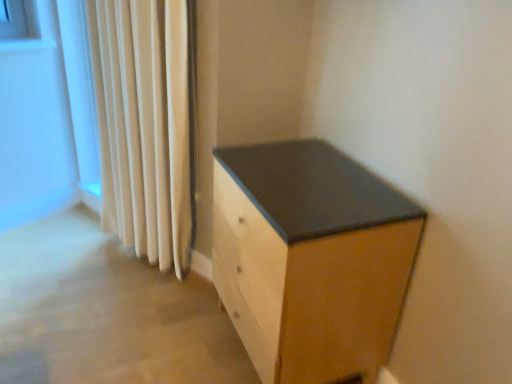
Question: Relative to beige fabric curtain at left, is matte black drawer at center in front or behind?

Choices:
 (A) behind
 (B) front

Answer: (B)

Question: From the image's perspective, is matte black drawer at center located above or below beige fabric curtain at left?

Choices:
 (A) above
 (B) below

Answer: (B)

Question: Based on their positions, is matte black drawer at center located to the left or right of beige fabric curtain at left?

Choices:
 (A) right
 (B) left

Answer: (A)

Question: From a real-world perspective, relative to matte black drawer at center, is beige fabric curtain at left vertically above or below?

Choices:
 (A) above
 (B) below

Answer: (A)

Question: Is beige fabric curtain at left taller or shorter than matte black drawer at center?

Choices:
 (A) short
 (B) tall

Answer: (B)

Question: Based on their positions, is beige fabric curtain at left located to the left or right of matte black drawer at center?

Choices:
 (A) left
 (B) right

Answer: (A)

Question: Is beige fabric curtain at left in front of or behind matte black drawer at center in the image?

Choices:
 (A) front
 (B) behind

Answer: (B)